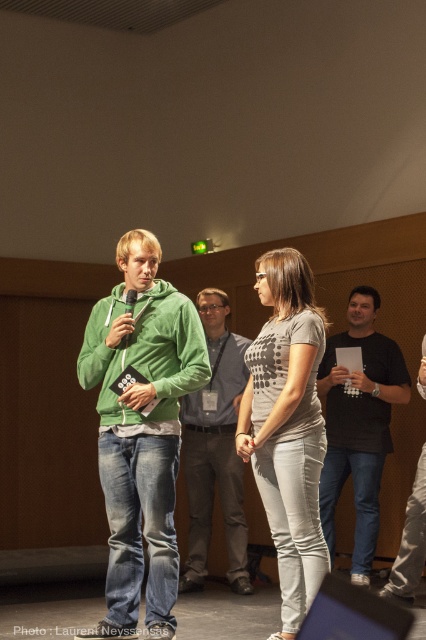
You are attending a presentation and need to pass between the green fleece hoodie at center and the green fabric shirt at center to reach the exit. Which direction should you move to avoid walking into the closer object?

The green fleece hoodie at center is closer to the viewer than the green fabric shirt at center, so you should move around the green fleece hoodie at center to avoid walking into it.

You are attending a presentation and notice two speakers on stage. The first speaker is wearing a green fabric shirt at center, and the second speaker is wearing a black matte shirt at right. Based on their height, which speaker would you estimate to be taller?

The green fabric shirt at center is much taller than the black matte shirt at right, so the first speaker wearing the green fabric shirt at center is estimated to be taller.